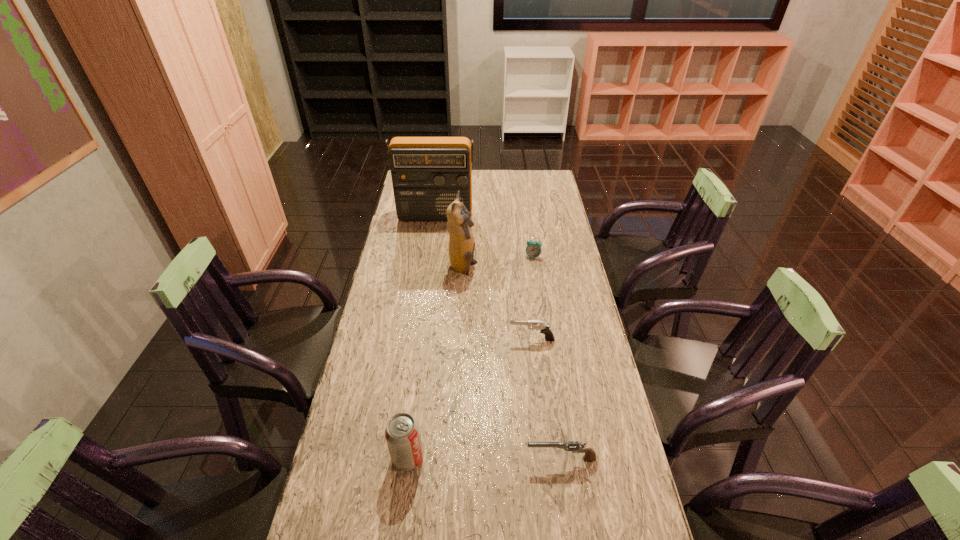
Find the location of a particular element. vacant space in between the shorter gun and the fifth nearest object is located at coordinates (547, 357).

Locate an element on the screen. The width and height of the screenshot is (960, 540). object identified as the closest to the nearer gun is located at coordinates (402, 434).

Locate an element on the screen. object that stands as the fifth closest to the farther gun is located at coordinates (427, 172).

I want to click on free space that satisfies the following two spatial constraints: 1. on the face of the alarm clock; 2. at the muzzle of the farther gun, so click(x=545, y=339).